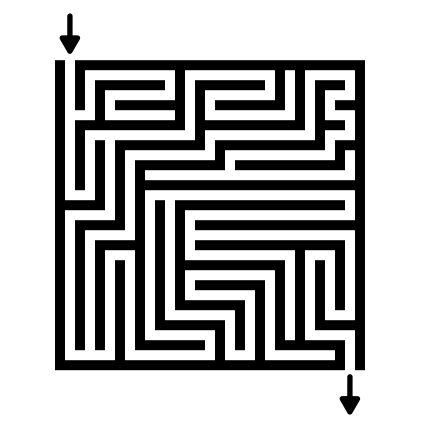
The image size is (426, 426). What are the coordinates of `entrace` in the screenshot? It's located at (68, 64).